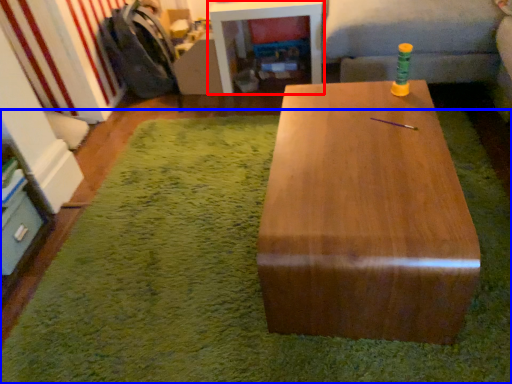
Question: Which of the following is the closest to the observer, table (highlighted by a red box) or mat (highlighted by a blue box)?

Choices:
 (A) table
 (B) mat

Answer: (B)